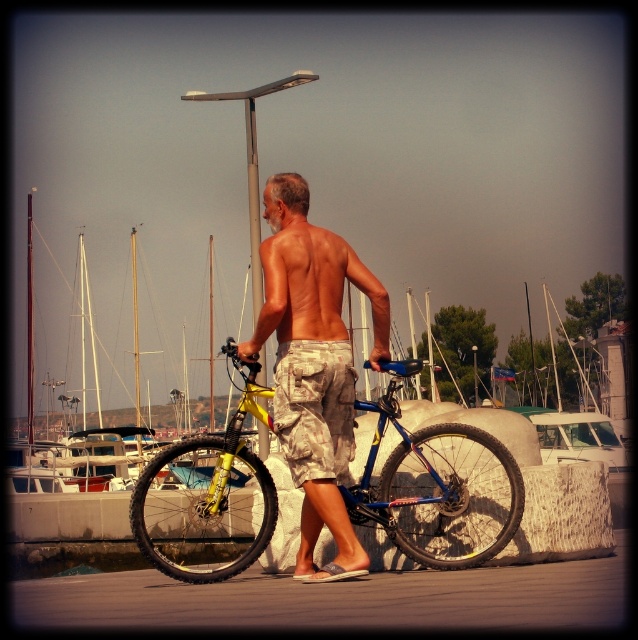
You are standing at the waterfront and see the man holding the yellow matte bicycle at center and the camouflage shorts at center. Which object is positioned to the left of the other?

The yellow matte bicycle at center is to the left of camouflage shorts at center.

You are a photographer standing at the waterfront scene. You want to take a photo of the yellow matte bicycle at center and the camouflage fabric shorts at center. Which object appears taller in the photo?

The yellow matte bicycle at center appears taller than the camouflage fabric shorts at center in the photo because the yellow matte bicycle at center has a greater height compared to camouflage fabric shorts at center.

You are standing at the edge of the marina and want to walk from point (x=470, y=483) to point (x=319, y=262). Which direction should you move to get closer to the latter?

You should move towards the background because point (x=319, y=262) is farther away from the viewer compared to point (x=470, y=483).